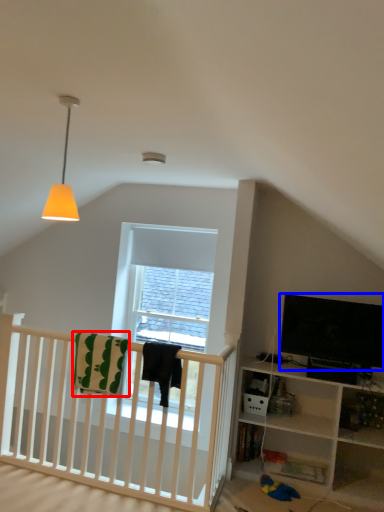
Question: Which object appears farthest to the camera in this image, blanket (highlighted by a red box) or television (highlighted by a blue box)?

Choices:
 (A) blanket
 (B) television

Answer: (B)